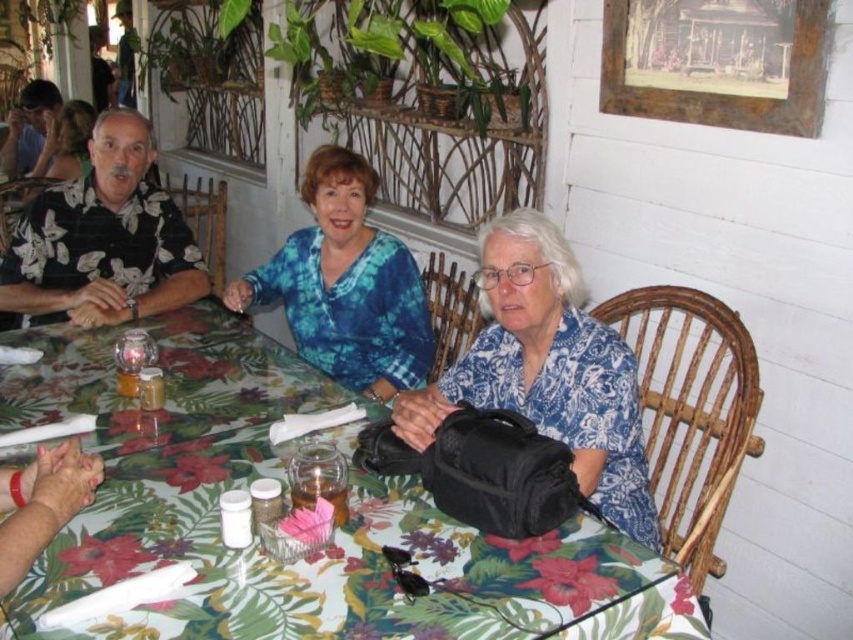
You are a waiter at the restaurant. You need to place a small dessert menu exactly at the point labeled point [285,486]. Where should you place it on the table?

Place the dessert menu at point [285,486] on the floral patterned tablecloth at center.